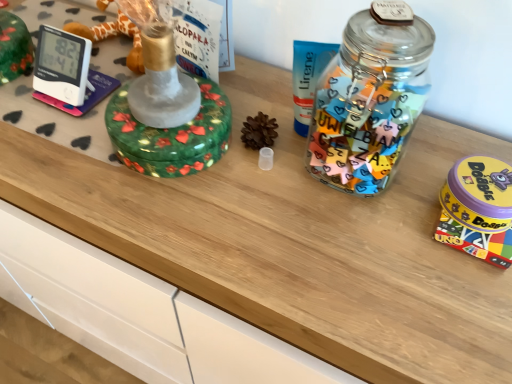
At what (x,y) coordinates should I click in order to perform the action: click on vacant space that is in between transparent plastic pinecone at center, arranged as the second toy when viewed from the right, and yellow plastic game at right, the 2th toy when ordered from left to right. Please return your answer as a coordinate pair (x, y). The image size is (512, 384). Looking at the image, I should click on (355, 193).